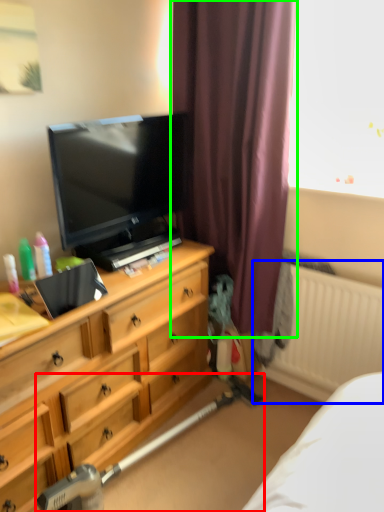
Question: Considering the real-world distances, which object is closest to equipment (highlighted by a red box)? radiator (highlighted by a blue box) or curtain (highlighted by a green box).

Choices:
 (A) radiator
 (B) curtain

Answer: (A)